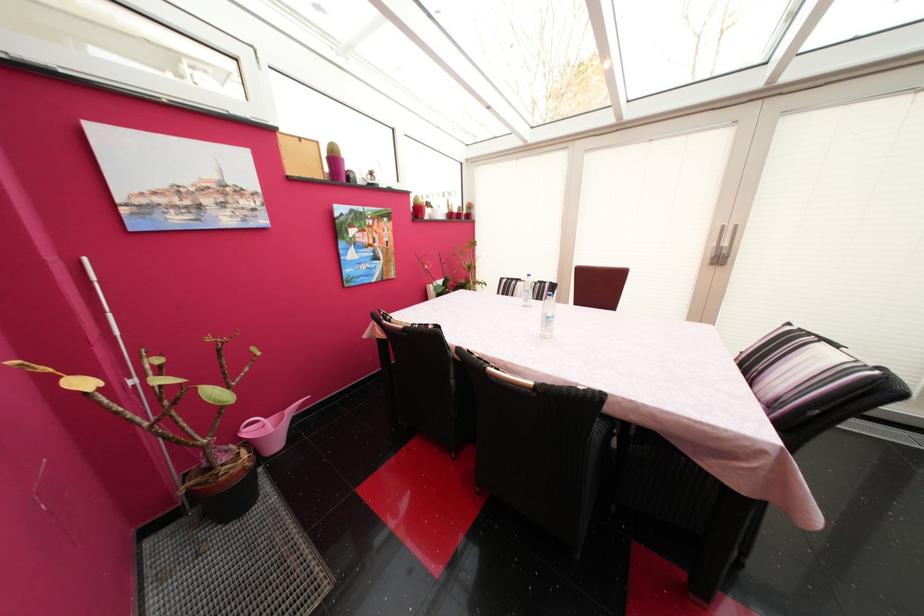
Where is `black plant pot`? black plant pot is located at coordinates (225, 484).